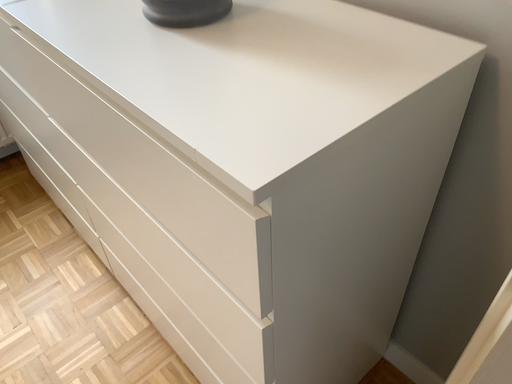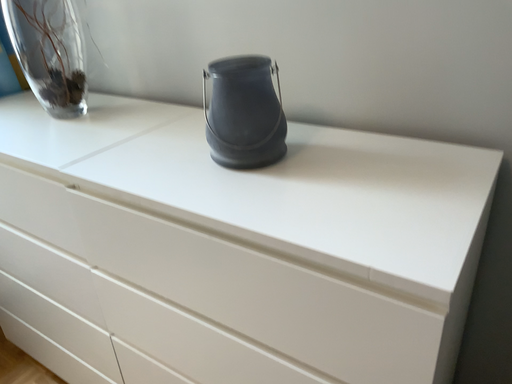
Question: How did the camera likely rotate when shooting the video?

Choices:
 (A) rotated upward
 (B) rotated downward

Answer: (A)